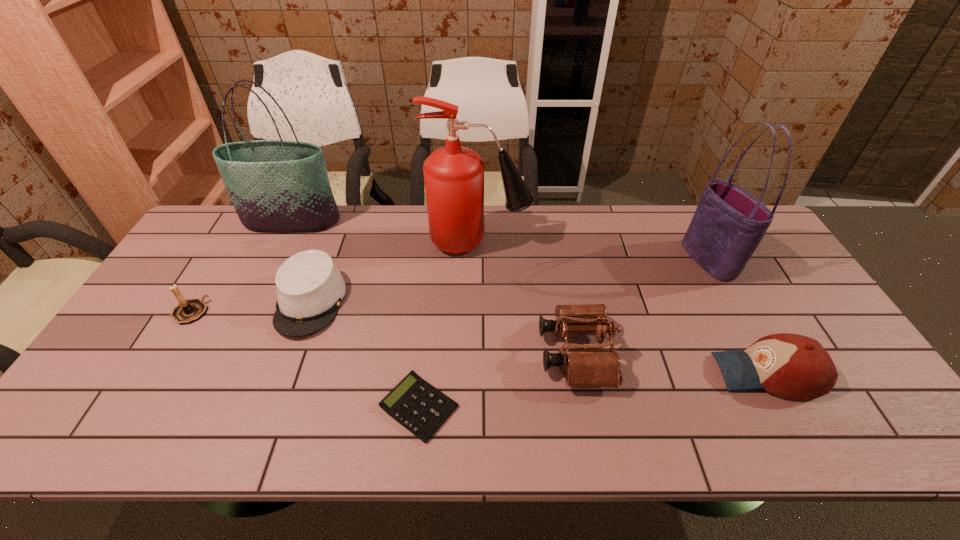
Locate an element on the screen. This screenshot has height=540, width=960. the left tote bag is located at coordinates (279, 186).

The height and width of the screenshot is (540, 960). In order to click on fire extinguisher in this screenshot , I will do `click(454, 175)`.

Identify the location of the right tote bag. (729, 223).

Where is `binoculars`? The width and height of the screenshot is (960, 540). binoculars is located at coordinates (587, 367).

You are a GUI agent. You are given a task and a screenshot of the screen. Output one action in this format:
    pyautogui.click(x=<x>, y=<y>)
    Task: Click on the baseball cap
    
    Given the screenshot: What is the action you would take?
    pyautogui.click(x=792, y=366)

Locate an element on the screen. candle holder is located at coordinates (188, 311).

Where is `the second shortest object`? This screenshot has height=540, width=960. the second shortest object is located at coordinates (310, 288).

Find the location of a particular element. Image resolution: width=960 pixels, height=540 pixels. the shortest object is located at coordinates (414, 403).

Find the location of a particular element. The width and height of the screenshot is (960, 540). vacant space situated on the left of the farther tote bag is located at coordinates (217, 221).

Locate an element on the screen. Image resolution: width=960 pixels, height=540 pixels. free location located 0.400m with the nozzle aimed from the fire extinguisher is located at coordinates (652, 241).